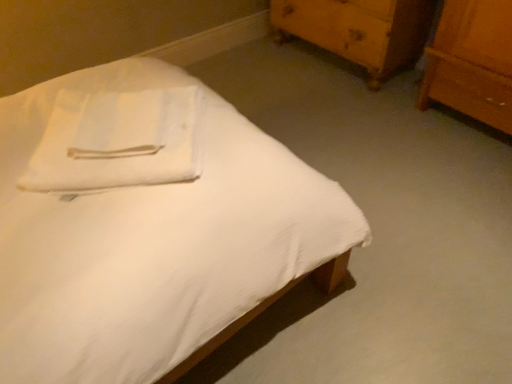
Question: Does white matte bed at center have a greater width compared to white cotton towel at upper left?

Choices:
 (A) no
 (B) yes

Answer: (B)

Question: Does white matte bed at center have a smaller size compared to white cotton towel at upper left?

Choices:
 (A) yes
 (B) no

Answer: (B)

Question: Does white matte bed at center have a lesser width compared to white cotton towel at upper left?

Choices:
 (A) yes
 (B) no

Answer: (B)

Question: Considering the relative positions of white matte bed at center and white cotton towel at upper left in the image provided, is white matte bed at center behind white cotton towel at upper left?

Choices:
 (A) yes
 (B) no

Answer: (B)

Question: Is the position of white matte bed at center less distant than that of white cotton towel at upper left?

Choices:
 (A) no
 (B) yes

Answer: (B)

Question: In terms of width, does wooden chest of drawers at upper right look wider or thinner when compared to white cotton towel at upper left?

Choices:
 (A) thin
 (B) wide

Answer: (B)

Question: From a real-world perspective, is wooden chest of drawers at upper right above or below white cotton towel at upper left?

Choices:
 (A) above
 (B) below

Answer: (B)

Question: Is point (293, 13) closer or farther from the camera than point (93, 125)?

Choices:
 (A) farther
 (B) closer

Answer: (A)

Question: Considering their positions, is wooden chest of drawers at upper right located in front of or behind white cotton towel at upper left?

Choices:
 (A) front
 (B) behind

Answer: (B)

Question: Considering their positions, is white cotton towel at upper left located in front of or behind wooden chest of drawers at upper right?

Choices:
 (A) behind
 (B) front

Answer: (B)

Question: From the image's perspective, is white cotton towel at upper left above or below wooden chest of drawers at upper right?

Choices:
 (A) below
 (B) above

Answer: (A)

Question: From their relative heights in the image, would you say white cotton towel at upper left is taller or shorter than wooden chest of drawers at upper right?

Choices:
 (A) tall
 (B) short

Answer: (B)

Question: From a real-world perspective, is white cotton towel at upper left positioned above or below wooden chest of drawers at upper right?

Choices:
 (A) above
 (B) below

Answer: (A)

Question: In the image, is white matte bed at center on the left side or the right side of wooden chest of drawers at upper right?

Choices:
 (A) left
 (B) right

Answer: (A)

Question: Is white matte bed at center in front of or behind wooden chest of drawers at upper right in the image?

Choices:
 (A) behind
 (B) front

Answer: (B)